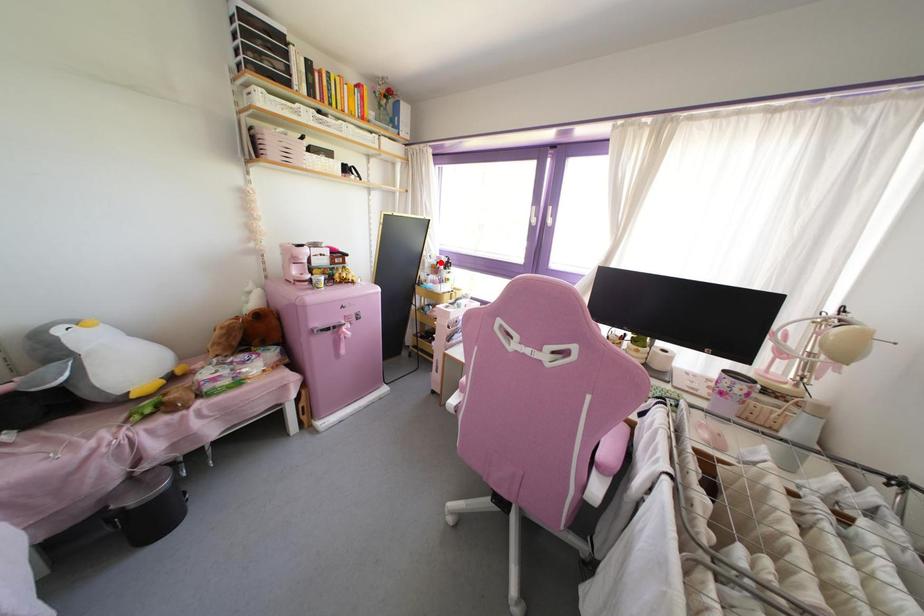
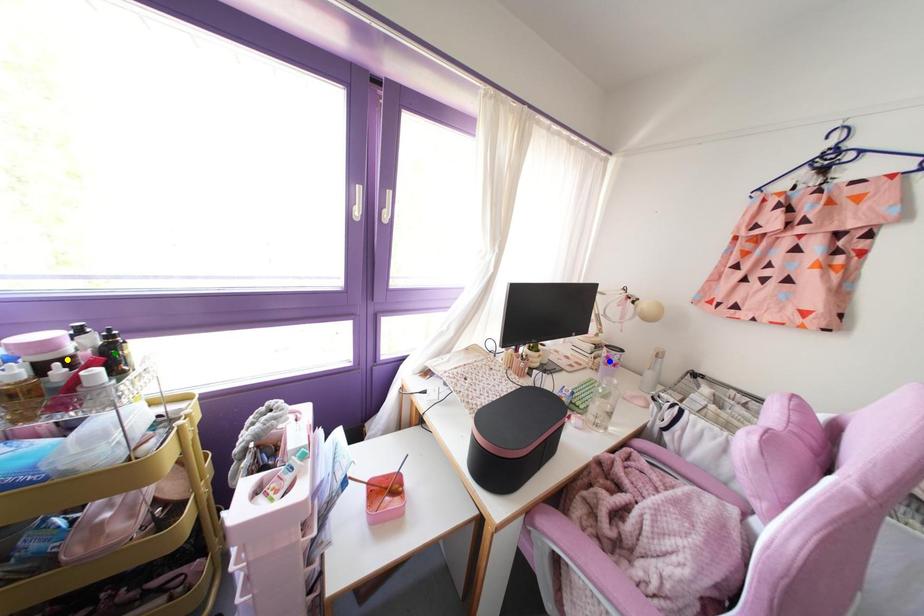
Question: I am providing you with two images of the same scene from different viewpoints. A red point is marked on the first image. You are given multiple points on the second image. In image 2, which mark is for the same physical point as the one in image 1?

Choices:
 (A) blue point
 (B) green point
 (C) yellow point

Answer: (C)